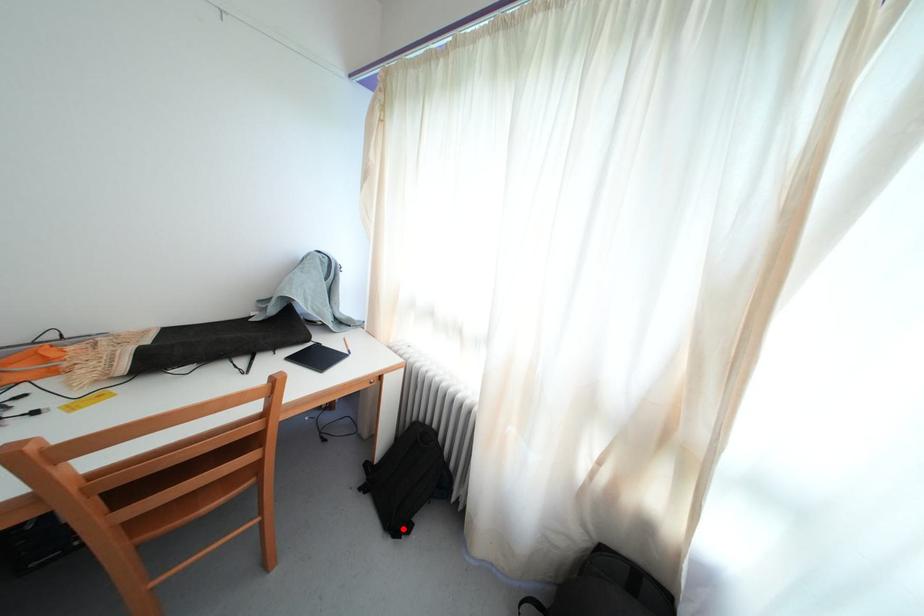
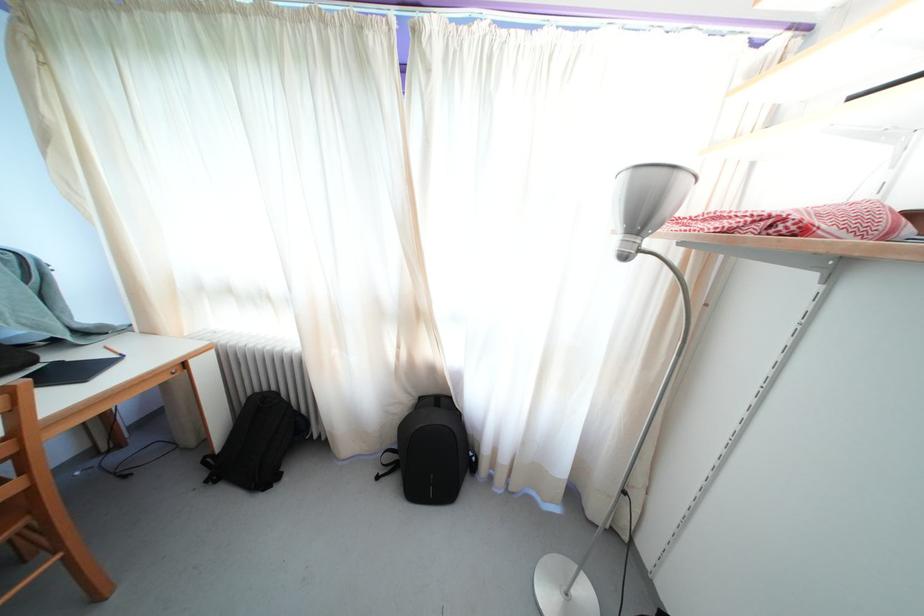
Question: I am providing you with two images of the same scene from different viewpoints. Given a red point in image1, look at the same physical point in image2. Is it:

Choices:
 (A) Closer to the viewpoint
 (B) Farther from the viewpoint

Answer: (A)